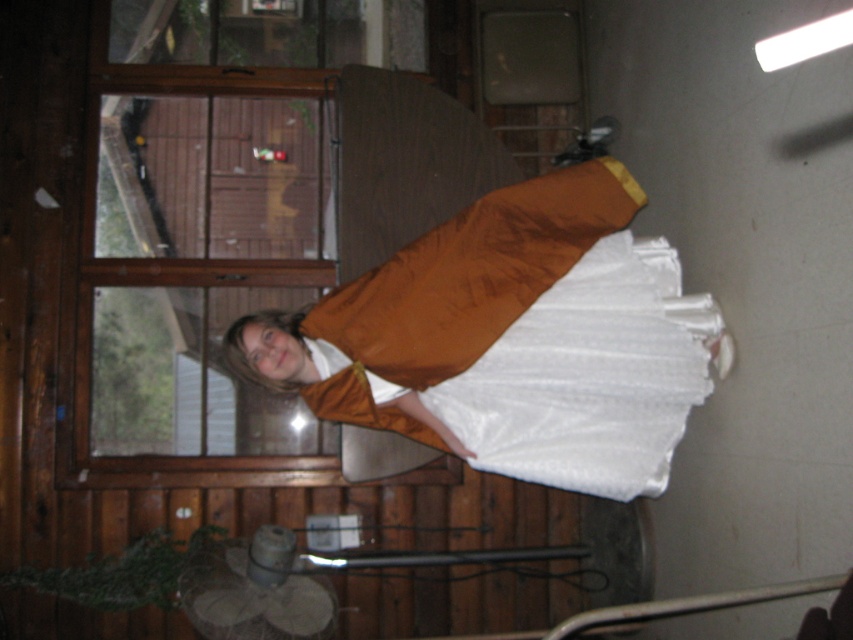
Question: Does shiny brown cape at center have a smaller size compared to metallic silver rail at lower center?

Choices:
 (A) yes
 (B) no

Answer: (A)

Question: Observing the image, what is the correct spatial positioning of shiny brown cape at center in reference to metallic silver rail at lower center?

Choices:
 (A) above
 (B) below

Answer: (A)

Question: Which point is farther to the camera?

Choices:
 (A) (786, 582)
 (B) (473, 422)

Answer: (B)

Question: Can you confirm if shiny brown cape at center is positioned above metallic silver rail at lower center?

Choices:
 (A) yes
 (B) no

Answer: (A)

Question: Which of the following is the closest to the observer?

Choices:
 (A) shiny brown cape at center
 (B) metallic silver rail at lower center

Answer: (B)

Question: Which object is farther from the camera taking this photo?

Choices:
 (A) shiny brown cape at center
 (B) metallic silver rail at lower center

Answer: (A)